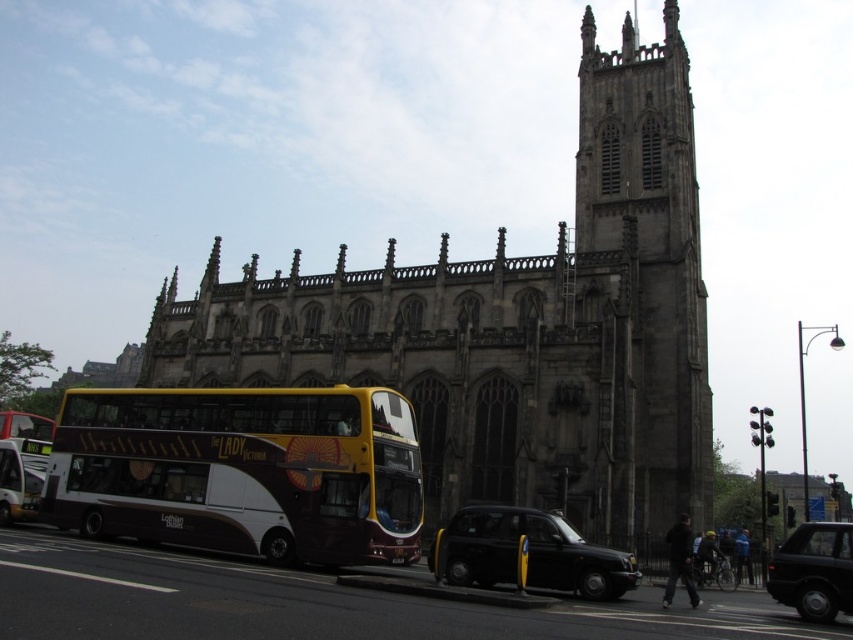
Question: Based on their relative distances, which object is farther from the black rubber car at lower right?

Choices:
 (A) dark gray stone tower at center
 (B) brown matte double-decker bus at center
 (C) white matte bus at lower left

Answer: (C)

Question: Can you confirm if brown matte double-decker bus at center is wider than black matte taxi at center?

Choices:
 (A) yes
 (B) no

Answer: (A)

Question: Among these points, which one is nearest to the camera?

Choices:
 (A) (695, 307)
 (B) (666, 438)
 (C) (494, 504)
 (D) (258, 428)

Answer: (D)

Question: Does dark gray stone church at center appear on the left side of black matte taxi at center?

Choices:
 (A) yes
 (B) no

Answer: (A)

Question: In this image, where is dark gray stone tower at center located relative to black rubber car at lower right?

Choices:
 (A) right
 (B) left

Answer: (B)

Question: Which object appears farthest from the camera in this image?

Choices:
 (A) black rubber car at lower right
 (B) white matte bus at lower left
 (C) brown matte double-decker bus at center
 (D) dark gray stone tower at center

Answer: (B)